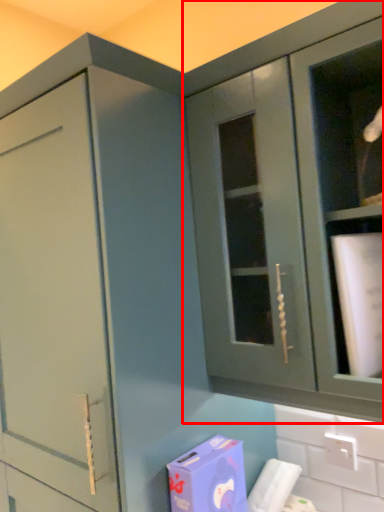
Question: From the image's perspective, considering the relative positions of cabinetry (annotated by the red box) and cardboard box in the image provided, where is cabinetry (annotated by the red box) located with respect to the staircase?

Choices:
 (A) above
 (B) below

Answer: (A)